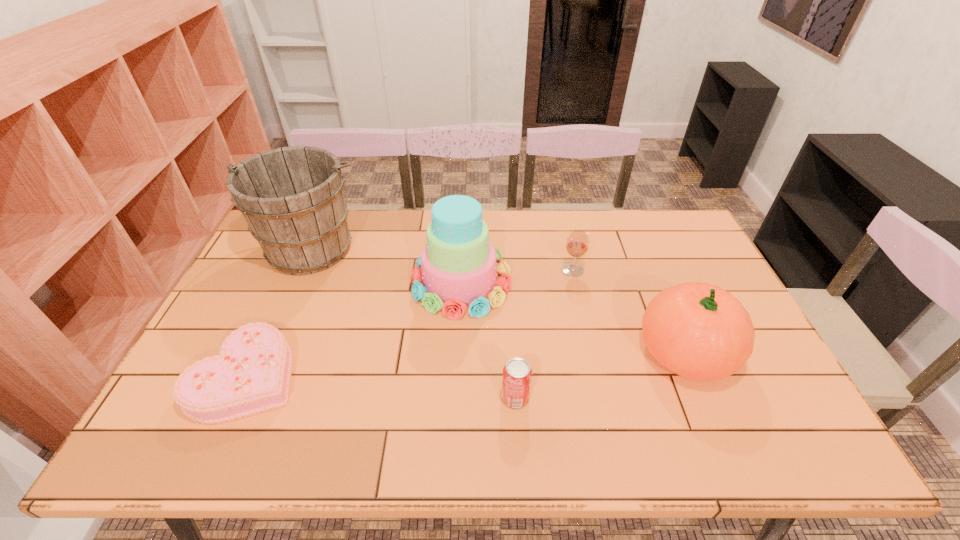
Where is `free space between the soda can and the shorter cake`? This screenshot has width=960, height=540. free space between the soda can and the shorter cake is located at coordinates (381, 387).

The image size is (960, 540). I want to click on vacant area that lies between the right cake and the left cake, so click(x=354, y=329).

At what (x,y) coordinates should I click in order to perform the action: click on empty space that is in between the bucket and the soda can. Please return your answer as a coordinate pair (x, y). The width and height of the screenshot is (960, 540). Looking at the image, I should click on (413, 322).

Locate an element on the screen. The width and height of the screenshot is (960, 540). unoccupied position between the fifth object from left to right and the fifth shortest object is located at coordinates (517, 276).

Locate an element on the screen. This screenshot has height=540, width=960. free space between the second tallest object and the soda can is located at coordinates (489, 340).

You are a GUI agent. You are given a task and a screenshot of the screen. Output one action in this format:
    pyautogui.click(x=<x>, y=<y>)
    Task: Click on the free area in between the pumpkin and the taller cake
    
    Given the screenshot: What is the action you would take?
    pyautogui.click(x=573, y=316)

Find the location of a particular element. The width and height of the screenshot is (960, 540). free space that is in between the pumpkin and the soda can is located at coordinates (600, 374).

At what (x,y) coordinates should I click in order to perform the action: click on free space between the soda can and the bucket. Please return your answer as a coordinate pair (x, y). Looking at the image, I should click on (413, 322).

At what (x,y) coordinates should I click in order to perform the action: click on the fourth closest object to the pumpkin. Please return your answer as a coordinate pair (x, y). The width and height of the screenshot is (960, 540). Looking at the image, I should click on (292, 198).

The image size is (960, 540). In order to click on object that is the fourth nearest to the bucket in this screenshot , I will do `click(577, 244)`.